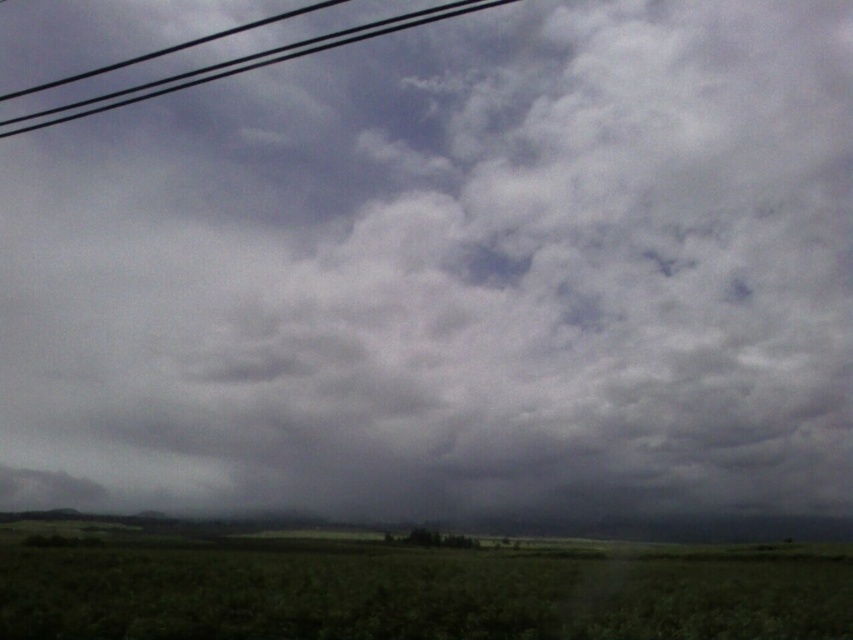
Question: In this image, where is green grass at lower center located relative to black wire at upper left?

Choices:
 (A) below
 (B) above

Answer: (A)

Question: Is green grass at lower center to the left of black wire at upper left from the viewer's perspective?

Choices:
 (A) no
 (B) yes

Answer: (A)

Question: Is green grass at lower center thinner than black wire at upper left?

Choices:
 (A) yes
 (B) no

Answer: (A)

Question: Which of the following is the farthest from the observer?

Choices:
 (A) green grass at lower center
 (B) black wire at upper left

Answer: (B)

Question: Among these points, which one is farthest from the camera?

Choices:
 (A) (358, 28)
 (B) (479, 602)

Answer: (A)